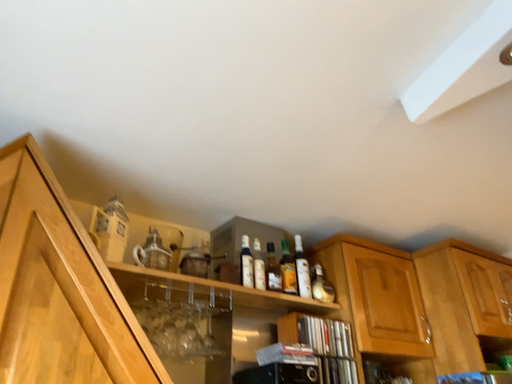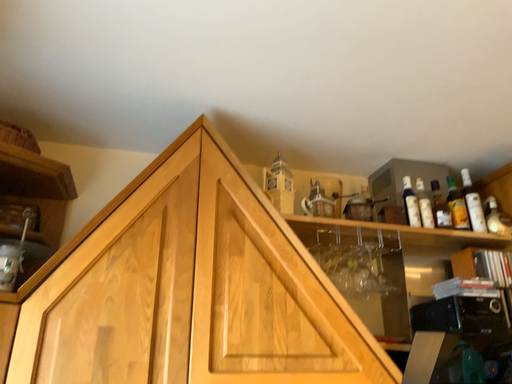
Question: How did the camera likely rotate when shooting the video?

Choices:
 (A) rotated upward
 (B) rotated downward

Answer: (B)